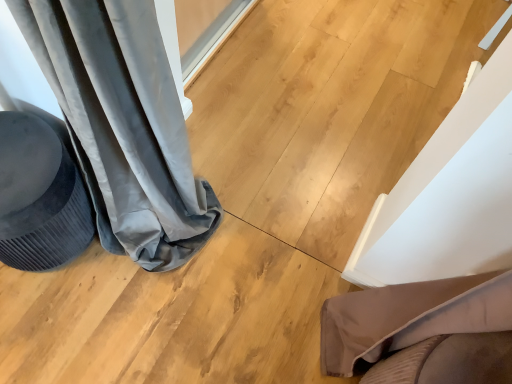
Find the location of a particular element. Image resolution: width=512 pixels, height=384 pixels. vacant area that is situated to the right of velvet dark gray swivel chair at left is located at coordinates (128, 284).